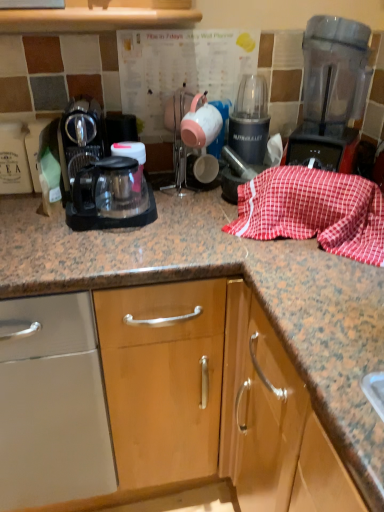
The height and width of the screenshot is (512, 384). What do you see at coordinates (331, 93) in the screenshot?
I see `transparent plastic blender at upper right` at bounding box center [331, 93].

Identify the location of black plastic coffee maker at left. (101, 175).

Identify the location of black plastic blender at center. The height and width of the screenshot is (512, 384). (250, 120).

Could you tell me if matte ceramic tea pot at center is facing black plastic blender at center?

No, matte ceramic tea pot at center is not oriented towards black plastic blender at center.

Considering their positions, is matte ceramic tea pot at center located in front of or behind black plastic blender at center?

Visually, matte ceramic tea pot at center is located in front of black plastic blender at center.

Which is correct: matte ceramic tea pot at center is inside black plastic blender at center, or outside of it?

matte ceramic tea pot at center is located beyond the bounds of black plastic blender at center.

From the picture: Is matte ceramic tea pot at center wider than black plastic blender at center?

No.

Can you confirm if transparent plastic blender at upper right is positioned to the left of black plastic coffee maker at left?

No.

Is point (331, 63) closer or farther from the camera than point (78, 173)?

Clearly, point (331, 63) is more distant from the camera than point (78, 173).

Is transparent plastic blender at upper right oriented away from black plastic coffee maker at left?

transparent plastic blender at upper right does not have its back to black plastic coffee maker at left.

How far apart are transparent plastic blender at upper right and black plastic coffee maker at left?

transparent plastic blender at upper right and black plastic coffee maker at left are 51.08 centimeters apart from each other.

Which object is positioned more to the left, black plastic coffee maker at left or black plastic blender at center?

black plastic coffee maker at left.

Considering the sizes of black plastic coffee maker at left and black plastic blender at center in the image, is black plastic coffee maker at left wider or thinner than black plastic blender at center?

Clearly, black plastic coffee maker at left has more width compared to black plastic blender at center.

Which of these two, black plastic coffee maker at left or black plastic blender at center, stands shorter?

black plastic coffee maker at left is shorter.

Is point (86, 175) closer or farther from the camera than point (228, 142)?

Point (86, 175).

From the picture: Is matte ceramic tea pot at center situated inside transparent plastic blender at upper right or outside?

matte ceramic tea pot at center cannot be found inside transparent plastic blender at upper right.

The image size is (384, 512). What are the coordinates of `home appliance on the right side of matte ceramic tea pot at center` in the screenshot? It's located at (331, 93).

Looking at their sizes, would you say matte ceramic tea pot at center is wider or thinner than transparent plastic blender at upper right?

Considering their sizes, matte ceramic tea pot at center looks slimmer than transparent plastic blender at upper right.

Does matte ceramic tea pot at center come behind transparent plastic blender at upper right?

That is True.

From a real-world perspective, is black plastic coffee maker at left physically above transparent plastic blender at upper right?

Actually, black plastic coffee maker at left is physically below transparent plastic blender at upper right in the real world.

Which object is positioned more to the left, black plastic coffee maker at left or transparent plastic blender at upper right?

black plastic coffee maker at left.

Considering the sizes of black plastic coffee maker at left and transparent plastic blender at upper right in the image, is black plastic coffee maker at left bigger or smaller than transparent plastic blender at upper right?

In the image, black plastic coffee maker at left appears to be smaller than transparent plastic blender at upper right.

The height and width of the screenshot is (512, 384). I want to click on kitchen appliance that appears below the transparent plastic blender at upper right (from a real-world perspective), so click(101, 175).

Is transparent plastic blender at upper right looking in the opposite direction of red checkered cloth at center?

That's not correct — transparent plastic blender at upper right is not looking away from red checkered cloth at center.

Who is shorter, transparent plastic blender at upper right or red checkered cloth at center?

red checkered cloth at center is shorter.

Is transparent plastic blender at upper right outside of red checkered cloth at center?

Yes, transparent plastic blender at upper right is not within red checkered cloth at center.

Between transparent plastic blender at upper right and red checkered cloth at center, which one has larger width?

transparent plastic blender at upper right is wider.

Considering the sizes of black plastic coffee maker at left and red checkered cloth at center in the image, is black plastic coffee maker at left wider or thinner than red checkered cloth at center?

Clearly, black plastic coffee maker at left has more width compared to red checkered cloth at center.

Choose the correct answer: Is black plastic coffee maker at left inside red checkered cloth at center or outside it?

black plastic coffee maker at left lies outside red checkered cloth at center.

From a real-world perspective, is black plastic coffee maker at left beneath red checkered cloth at center?

No, from a real-world perspective, black plastic coffee maker at left is not beneath red checkered cloth at center.

This screenshot has width=384, height=512. Identify the location of kitchen appliance on the left of red checkered cloth at center. (101, 175).

Where is `tea pot to the left of black plastic blender at center`? Image resolution: width=384 pixels, height=512 pixels. tea pot to the left of black plastic blender at center is located at coordinates (201, 123).

Find the location of a particular element. This screenshot has width=384, height=512. kitchen appliance in front of the transparent plastic blender at upper right is located at coordinates (101, 175).

When comparing their distances from black plastic coffee maker at left, does red checkered cloth at center or black plastic blender at center seem further?

black plastic blender at center is further to black plastic coffee maker at left.

Based on their spatial positions, is black plastic coffee maker at left or transparent plastic blender at upper right further from red checkered cloth at center?

black plastic coffee maker at left is positioned further to the anchor red checkered cloth at center.

From the image, which object appears to be nearer to red checkered cloth at center, transparent plastic blender at upper right or black plastic coffee maker at left?

transparent plastic blender at upper right.

Looking at the image, which one is located closer to black plastic blender at center, transparent plastic blender at upper right or black plastic coffee maker at left?

The object closer to black plastic blender at center is transparent plastic blender at upper right.

Looking at the image, which one is located closer to transparent plastic blender at upper right, matte ceramic tea pot at center or black plastic blender at center?

black plastic blender at center lies closer to transparent plastic blender at upper right than the other object.

When comparing their distances from transparent plastic blender at upper right, does matte ceramic tea pot at center or black plastic coffee maker at left seem further?

black plastic coffee maker at left.

Which object lies further to the anchor point black plastic coffee maker at left, transparent plastic blender at upper right or red checkered cloth at center?

Among the two, transparent plastic blender at upper right is located further to black plastic coffee maker at left.

Consider the image. Considering their positions, is black plastic blender at center positioned closer to transparent plastic blender at upper right than red checkered cloth at center?

Among the two, red checkered cloth at center is located nearer to transparent plastic blender at upper right.

The height and width of the screenshot is (512, 384). What are the coordinates of `tea pot situated between black plastic coffee maker at left and red checkered cloth at center from left to right` in the screenshot? It's located at (201, 123).

Locate an element on the screen. This screenshot has height=512, width=384. appliance situated between black plastic coffee maker at left and transparent plastic blender at upper right from left to right is located at coordinates (250, 120).

Find the location of a particular element. This screenshot has width=384, height=512. tea pot between black plastic coffee maker at left and black plastic blender at center from left to right is located at coordinates (201, 123).

Where is `blanket situated between black plastic coffee maker at left and transparent plastic blender at upper right from left to right`? The width and height of the screenshot is (384, 512). blanket situated between black plastic coffee maker at left and transparent plastic blender at upper right from left to right is located at coordinates (314, 211).